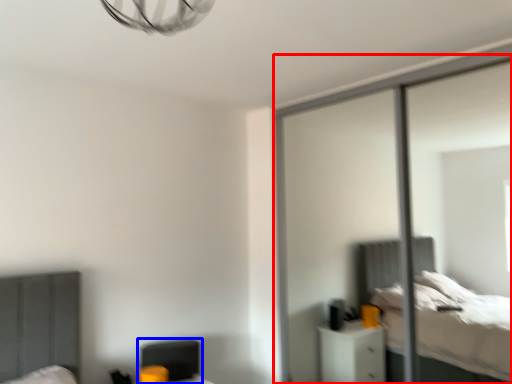
Question: Which object is further to the camera taking this photo, screen door (highlighted by a red box) or swivel chair (highlighted by a blue box)?

Choices:
 (A) screen door
 (B) swivel chair

Answer: (B)